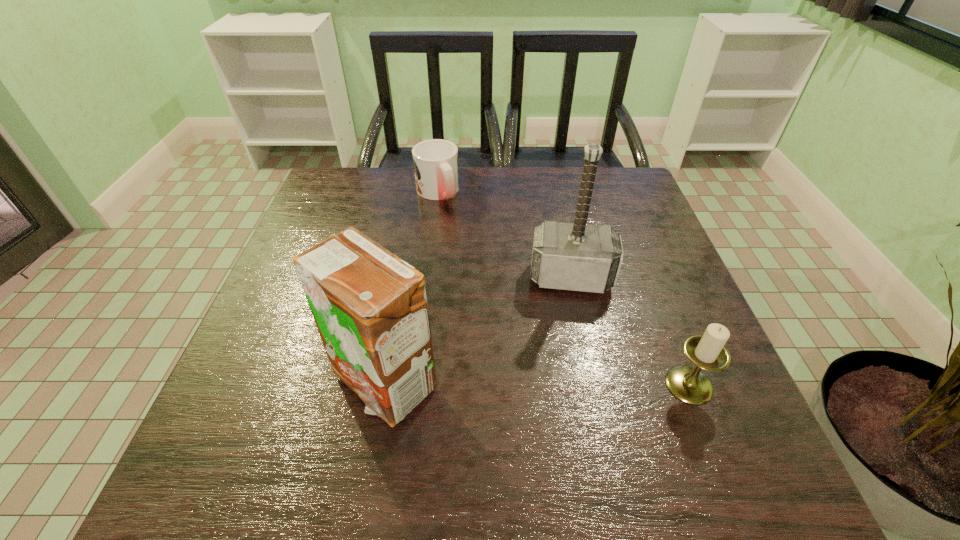
This screenshot has height=540, width=960. I want to click on vacant area that lies between the second object from right to left and the farthest object, so click(x=504, y=235).

The width and height of the screenshot is (960, 540). In order to click on object that can be found as the third closest to the hammer in this screenshot , I will do `click(435, 161)`.

Identify which object is the second nearest to the carton. Please provide its 2D coordinates. Your answer should be formatted as a tuple, i.e. [(x, y)], where the tuple contains the x and y coordinates of a point satisfying the conditions above.

[(707, 351)]

Where is `vacant area in the image that satisfies the following two spatial constraints: 1. on the straw side of the rightmost object; 2. on the right side of the carton`? This screenshot has height=540, width=960. vacant area in the image that satisfies the following two spatial constraints: 1. on the straw side of the rightmost object; 2. on the right side of the carton is located at coordinates (383, 385).

The image size is (960, 540). Identify the location of vacant space that satisfies the following two spatial constraints: 1. on the front side of the candle holder; 2. on the right side of the farthest object. (413, 385).